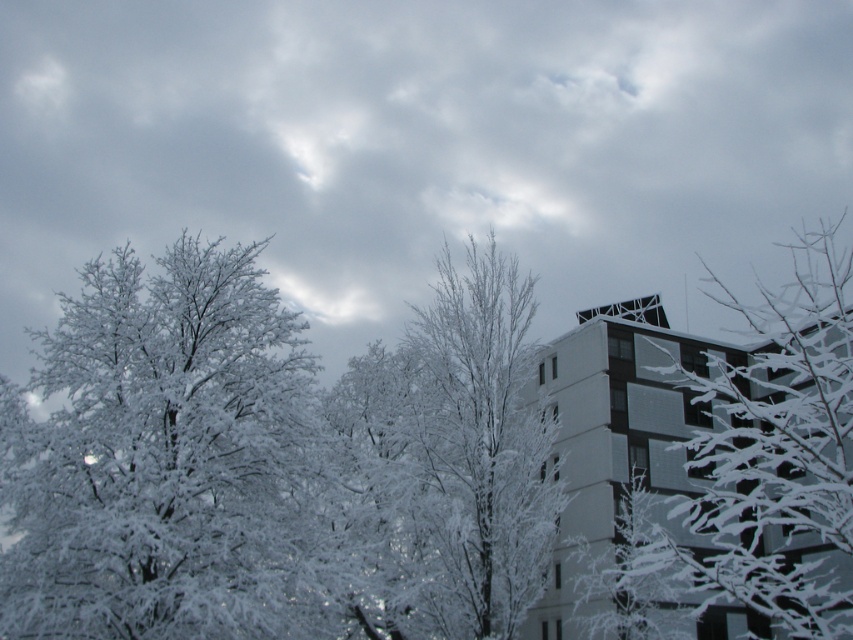
You are an architect analyzing the winter scene. You notice the cloudy at upper center and the white frosty tree at left. Which object in the scene occupies a bigger area?

The cloudy at upper center has a larger size compared to the white frosty tree at left, so the cloudy at upper center occupies a bigger area in the scene.